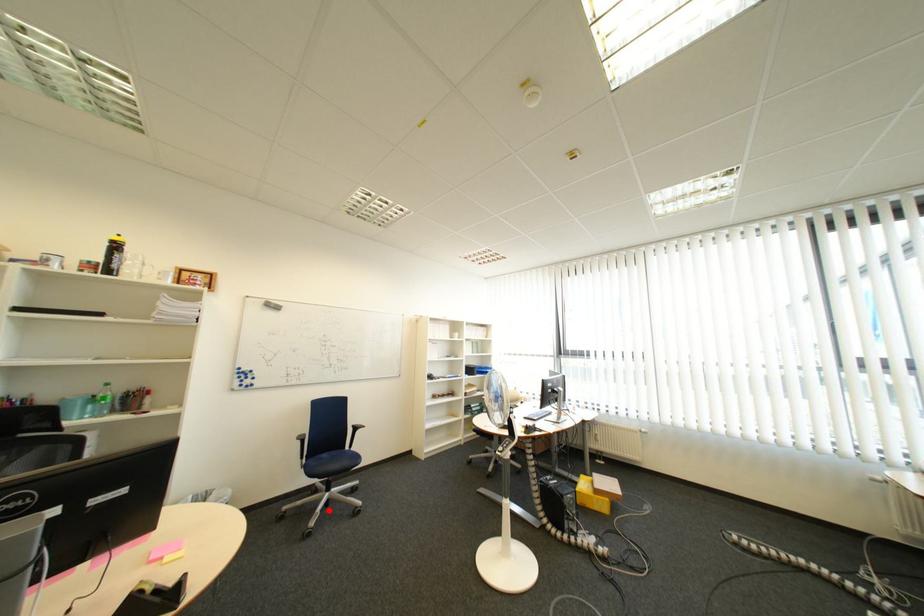
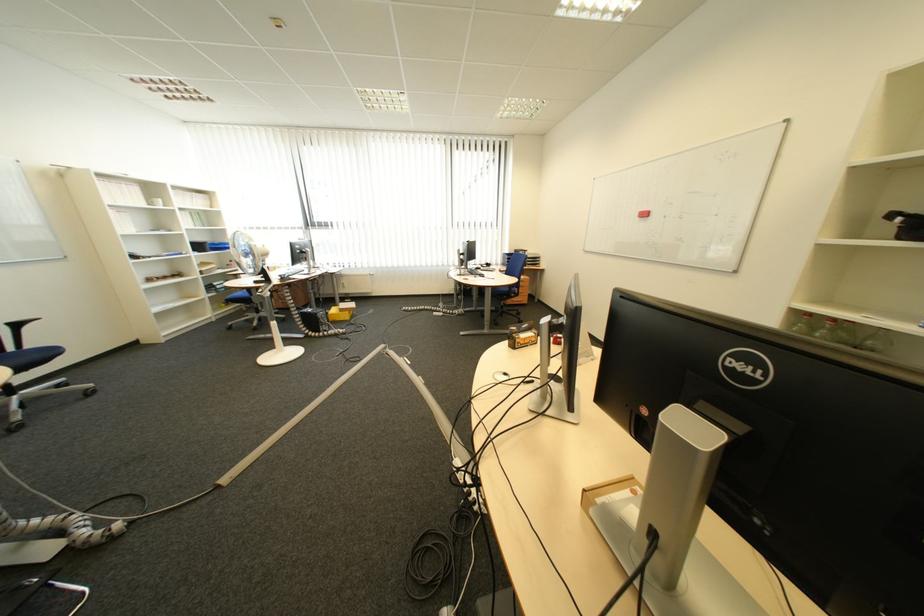
Find the pixel in the second image that matches the highlighted location in the first image.

(21, 411)